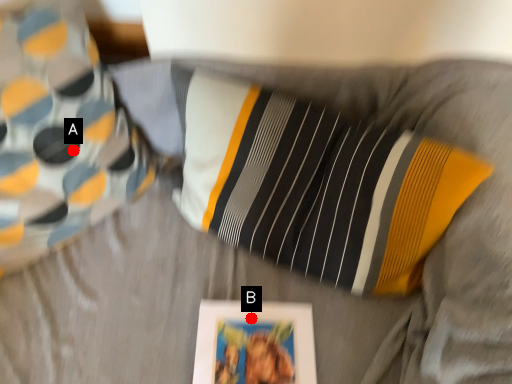
Question: Two points are circled on the image, labeled by A and B beside each circle. Which point is closer to the camera taking this photo?

Choices:
 (A) A is closer
 (B) B is closer

Answer: (B)